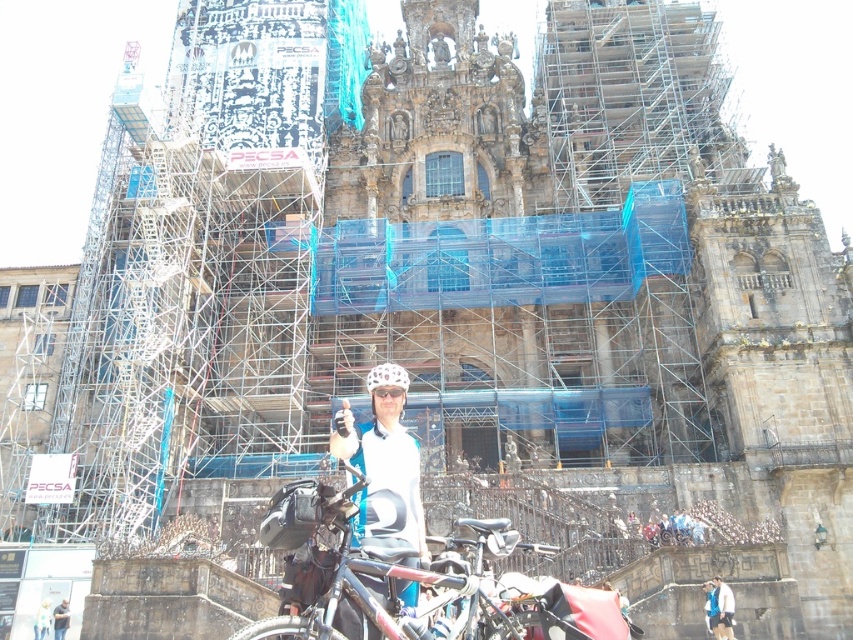
You are a surveyor measuring the position of objects in the image. The coordinate system has the origin at the bottom left corner. Where is the white matte helmet at center located?

The white matte helmet at center is located at point (383, 472).

You are standing in front of the historic building and notice two points marked in the scene. The first point is at coordinates point (712, 580) and the second is at point (48, 604). Which of these two points is nearer to your current position?

Point (712, 580) is closer to the camera than point (48, 604), so the first point is nearer to your current position.